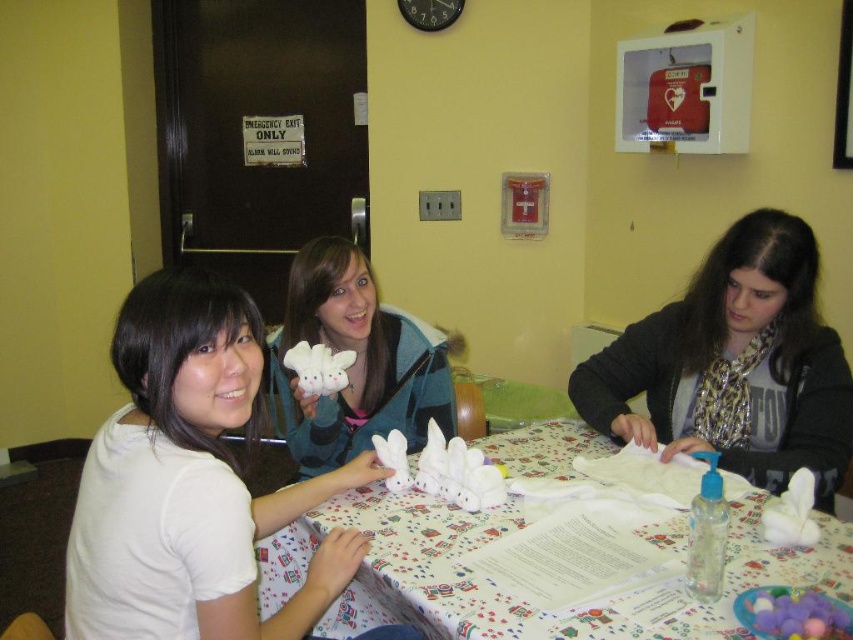
Does white paper towel at center appear under white plush toy at center?

Yes.

Is white paper towel at center to the left of white plush toy at center from the viewer's perspective?

In fact, white paper towel at center is to the right of white plush toy at center.

What do you see at coordinates (531, 605) in the screenshot?
I see `white paper towel at center` at bounding box center [531, 605].

The image size is (853, 640). I want to click on white paper towel at center, so click(531, 605).

Between matte black scarf at center and white paper towel at center, which one is positioned lower?

Positioned lower is white paper towel at center.

Locate an element on the screen. matte black scarf at center is located at coordinates (734, 364).

Who is more forward, (641, 422) or (480, 605)?

Positioned in front is point (480, 605).

Where is `matte black scarf at center`? matte black scarf at center is located at coordinates click(x=734, y=364).

The width and height of the screenshot is (853, 640). What do you see at coordinates (190, 481) in the screenshot?
I see `white matte shirt at left` at bounding box center [190, 481].

How much distance is there between white matte shirt at left and white paper towel at center?

The distance of white matte shirt at left from white paper towel at center is 33.02 centimeters.

The height and width of the screenshot is (640, 853). What do you see at coordinates (190, 481) in the screenshot? I see `white matte shirt at left` at bounding box center [190, 481].

This screenshot has width=853, height=640. Find the location of `white matte shirt at left`. white matte shirt at left is located at coordinates (190, 481).